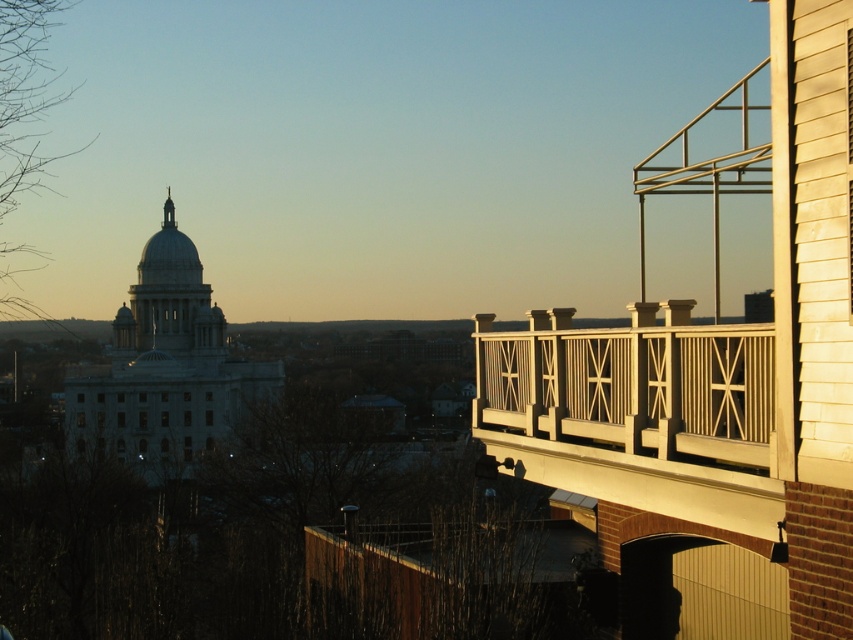
Question: Which point is closer to the camera taking this photo?

Choices:
 (A) (640, 400)
 (B) (169, 230)

Answer: (A)

Question: Which point is farther to the camera?

Choices:
 (A) white painted wood balcony at upper right
 (B) white smooth dome at upper center

Answer: (B)

Question: Can you confirm if white painted wood balcony at upper right is positioned above white smooth dome at upper center?

Choices:
 (A) yes
 (B) no

Answer: (B)

Question: Which point appears farthest from the camera in this image?

Choices:
 (A) (173, 230)
 (B) (756, 449)

Answer: (A)

Question: Is white painted wood balcony at upper right wider than white smooth dome at upper center?

Choices:
 (A) no
 (B) yes

Answer: (A)

Question: Does white painted wood balcony at upper right have a lesser width compared to white smooth dome at upper center?

Choices:
 (A) no
 (B) yes

Answer: (B)